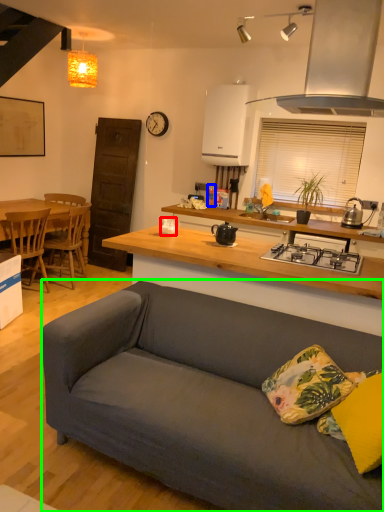
Question: Considering the real-world distances, which object is closest to coffee cup (highlighted by a red box)? bottle (highlighted by a blue box) or studio couch (highlighted by a green box).

Choices:
 (A) bottle
 (B) studio couch

Answer: (B)